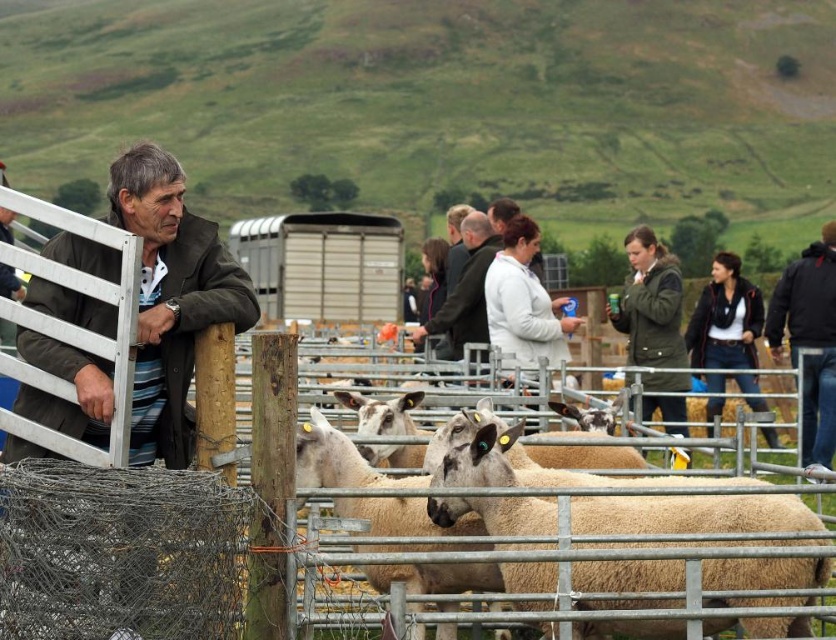
Question: Considering the real-world distances, which object is closest to the dark green jacket at right?

Choices:
 (A) white woolen sheep at center
 (B) olive-green fabric jacket at left
 (C) metallic silver fence at center
 (D) fuzzy woolen sheep at center

Answer: (C)

Question: Can you confirm if olive-green fabric jacket at left is positioned to the left of white woolen sheep at center?

Choices:
 (A) no
 (B) yes

Answer: (B)

Question: Is white woolen sheep at center thinner than fuzzy woolen sheep at center?

Choices:
 (A) no
 (B) yes

Answer: (A)

Question: Based on their relative distances, which object is farther from the white coat at center?

Choices:
 (A) fuzzy woolen sheep at center
 (B) olive-green fabric jacket at left
 (C) metallic silver fence at center
 (D) white woolen sheep at center

Answer: (B)

Question: In this image, where is fuzzy woolen sheep at center located relative to dark green jacket at right?

Choices:
 (A) left
 (B) right

Answer: (A)

Question: Which point is closer to the camera?

Choices:
 (A) dark green jacket at right
 (B) metallic silver fence at center

Answer: (B)